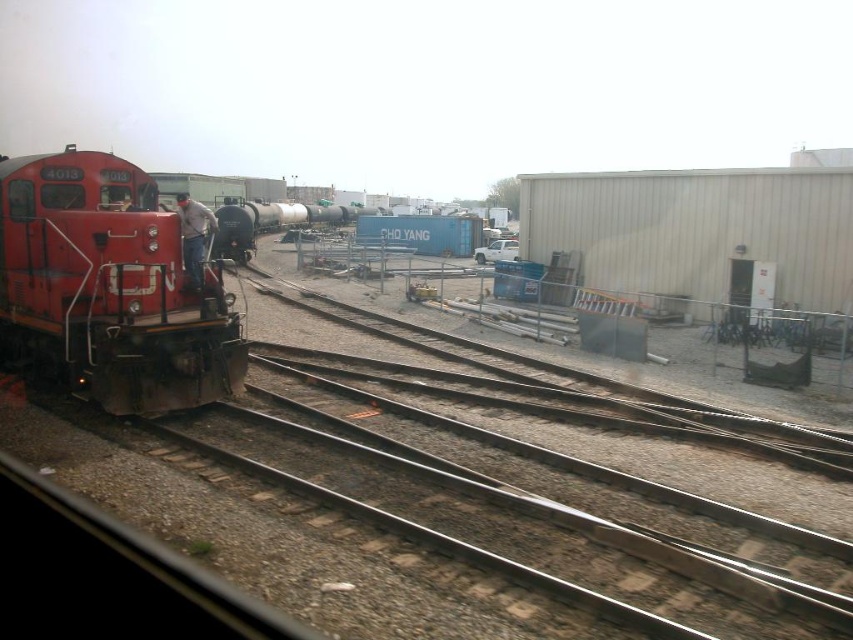
You are a railway inspector who needs to ensure that the black glossy tank car at center and the clear glass window at left can both fit through a narrow tunnel entrance that is exactly 5 meters wide. Based on their widths, can both objects pass through the tunnel simultaneously without any modifications?

The black glossy tank car at center might be wider than clear glass window at left. Since the tunnel entrance is exactly 5 meters wide, it is uncertain if both can pass simultaneously without knowing the exact widths of both objects. Further measurements are needed to confirm.

You are a maintenance worker in the railway yard. You need to place a 1.5 meter long ladder between the denim jacket at left and the clear glass window at left. Is there enough space to place it horizontally between them?

The denim jacket at left and the clear glass window at left are 2.09 meters apart from each other. Since the ladder is 1.5 meters long, there is sufficient space to place it horizontally between them.

You are a railway worker standing at point (55, 205). You need to walk to point (186, 202). Which direction should you move relative to your current position?

You should move backward because point (186, 202) is behind point (55, 205).